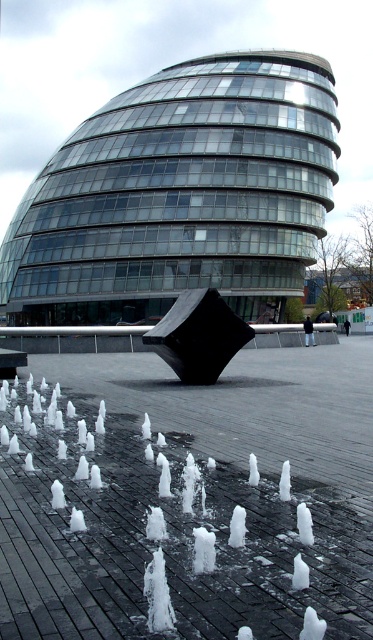
You are standing in front of the transparent glass building at center and want to walk to the black polished cube at center. In which direction should you move relative to the building?

The transparent glass building at center is to the left of the black polished cube at center, so you should move to your right to reach the black polished cube at center from the building.

You are standing in front of the modern architectural structure and want to take a photo of the black polished cube at center without the transparent glass building at center appearing in the background. Is this possible given their positions?

The transparent glass building at center is positioned over the black polished cube at center, so it would be difficult to take a photo of the black polished cube at center without the transparent glass building at center appearing in the background.

You are an architect evaluating the modern building and its sculpture. Given the transparent glass building at center and the black polished cube at center, which object would cast a larger shadow during midday when the sun is directly overhead?

The transparent glass building at center is much taller than the black polished cube at center, so it would cast a larger shadow during midday when the sun is directly overhead.